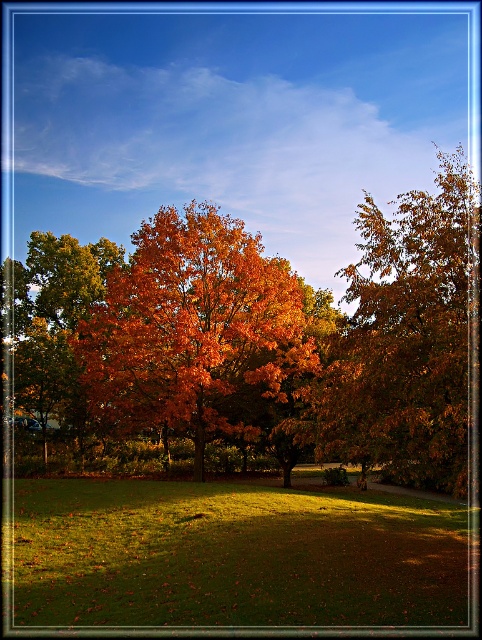
In the scene shown: You are standing at point (407, 282) and want to walk to point (163, 282). Is the path between these two points clear of any obstacles?

The path between point (407, 282) and point (163, 282) is clear of obstacles because point (163, 282) is behind point (407, 282), meaning there are no objects blocking the direct line between them.